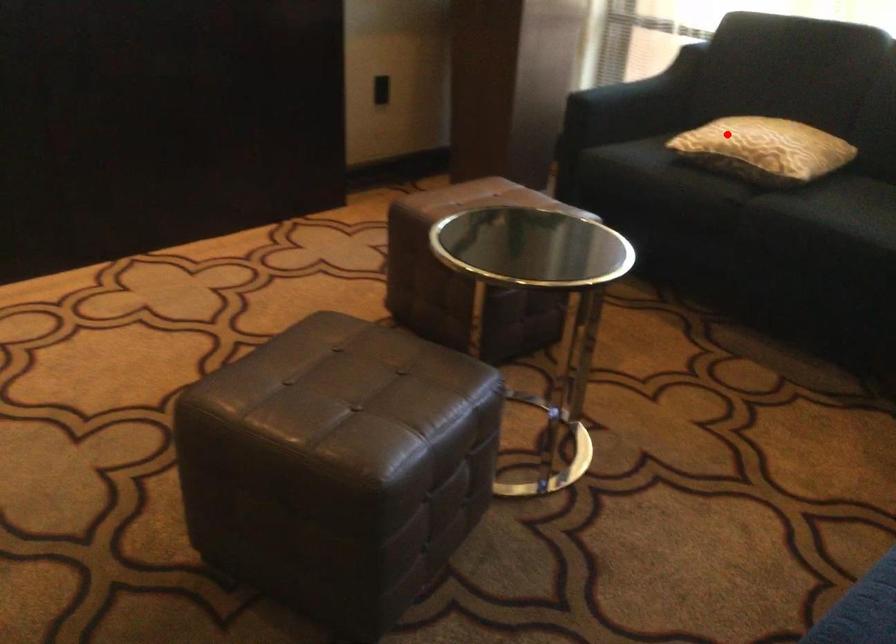
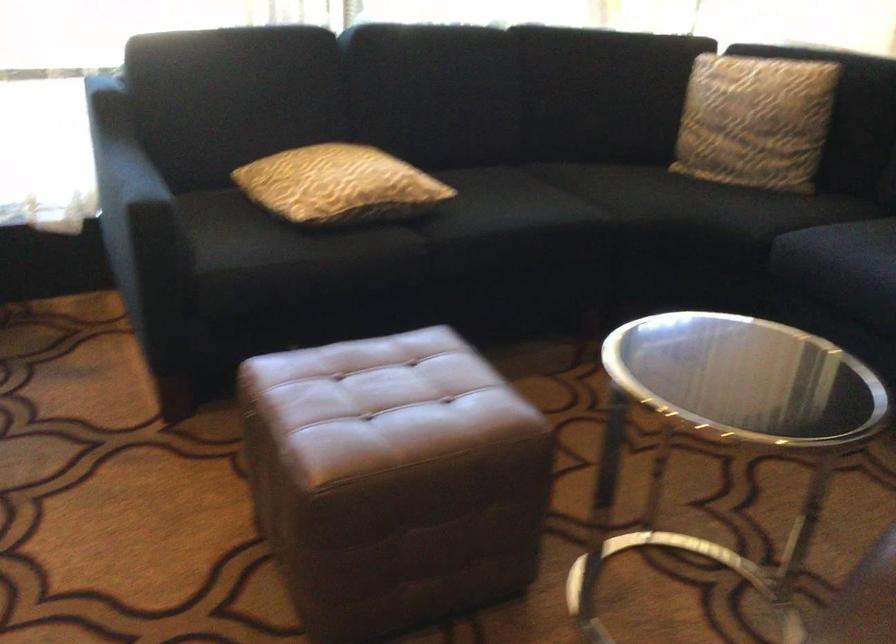
The point at the highlighted location is marked in the first image. Where is the corresponding point in the second image?

(339, 185)